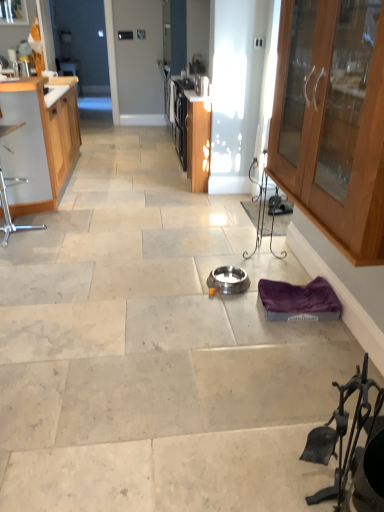
What do you see at coordinates (201, 85) in the screenshot? This screenshot has width=384, height=512. I see `metallic stainless steel toaster at upper center, which appears as the first appliance when viewed from the back` at bounding box center [201, 85].

Image resolution: width=384 pixels, height=512 pixels. What are the coordinates of `metallic silver chair at left, the second chair from the front` in the screenshot? It's located at (9, 210).

In order to face black wrought iron fireplace tools at lower right, which is counted as the second chair, starting from the top, should I rotate leftwards or rightwards?

Rotate right and turn 20.004 degrees.

Image resolution: width=384 pixels, height=512 pixels. What do you see at coordinates (40, 142) in the screenshot?
I see `wooden cabinet at left, the 2th cabinetry positioned from the front` at bounding box center [40, 142].

Locate an element on the screen. satin silver bowl at center, arranged as the second appliance when viewed from the back is located at coordinates (228, 280).

Is wooden cabinet at right, which is the first cabinetry from front to back, completely or partially inside satin silver bowl at center, which appears as the first appliance when viewed from the front?

Definitely not — wooden cabinet at right, which is the first cabinetry from front to back, is not inside satin silver bowl at center, which appears as the first appliance when viewed from the front.

In terms of height, does satin silver bowl at center, arranged as the second appliance when viewed from the back, look taller or shorter compared to wooden cabinet at right, which ranks as the 1th cabinetry in right-to-left order?

In the image, satin silver bowl at center, arranged as the second appliance when viewed from the back, appears to be shorter than wooden cabinet at right, which ranks as the 1th cabinetry in right-to-left order.

From a real-world perspective, which appliance is the 2nd one underneath the wooden cabinet at right, marked as the second cabinetry in a back-to-front arrangement? Please provide its 2D coordinates.

[(228, 280)]

Can you confirm if satin silver bowl at center, positioned as the first appliance in bottom-to-top order, is smaller than wooden cabinet at right, which is the first cabinetry from front to back?

Yes, satin silver bowl at center, positioned as the first appliance in bottom-to-top order, is smaller than wooden cabinet at right, which is the first cabinetry from front to back.

From a real-world perspective, is satin silver bowl at center, the 1th appliance from the right, positioned over metallic stainless steel toaster at upper center, positioned as the 1th appliance in left-to-right order, based on gravity?

No, from a real-world perspective, satin silver bowl at center, the 1th appliance from the right, is not on top of metallic stainless steel toaster at upper center, positioned as the 1th appliance in left-to-right order.

Consider the image. How much distance is there between satin silver bowl at center, the 1th appliance from the right, and metallic stainless steel toaster at upper center, which appears as the second appliance when viewed from the right?

satin silver bowl at center, the 1th appliance from the right, and metallic stainless steel toaster at upper center, which appears as the second appliance when viewed from the right, are 8.77 feet apart.

Visually, is satin silver bowl at center, which appears as the first appliance when viewed from the front, positioned to the left or to the right of metallic stainless steel toaster at upper center, positioned as the 1th appliance in left-to-right order?

In the image, satin silver bowl at center, which appears as the first appliance when viewed from the front, appears on the right side of metallic stainless steel toaster at upper center, positioned as the 1th appliance in left-to-right order.

Image resolution: width=384 pixels, height=512 pixels. What are the coordinates of `appliance that is behind the satin silver bowl at center, which appears as the first appliance when viewed from the front` in the screenshot? It's located at (201, 85).

Considering the relative sizes of satin silver bowl at center, which appears as the first appliance when viewed from the front, and black wrought iron fireplace tools at lower right, acting as the second chair starting from the back, in the image provided, is satin silver bowl at center, which appears as the first appliance when viewed from the front, wider than black wrought iron fireplace tools at lower right, acting as the second chair starting from the back,?

Yes, satin silver bowl at center, which appears as the first appliance when viewed from the front, is wider than black wrought iron fireplace tools at lower right, acting as the second chair starting from the back.

How much distance is there between satin silver bowl at center, the 1th appliance from the right, and black wrought iron fireplace tools at lower right, the second chair positioned from the left?

satin silver bowl at center, the 1th appliance from the right, is 1.25 meters away from black wrought iron fireplace tools at lower right, the second chair positioned from the left.

Is satin silver bowl at center, which appears as the first appliance when viewed from the front, completely or partially outside of black wrought iron fireplace tools at lower right, which is counted as the second chair, starting from the top?

satin silver bowl at center, which appears as the first appliance when viewed from the front, lies outside black wrought iron fireplace tools at lower right, which is counted as the second chair, starting from the top,'s area.

Is satin silver bowl at center, the 2th appliance in the top-to-bottom sequence, next to black wrought iron fireplace tools at lower right, which is counted as the second chair, starting from the top?

No, satin silver bowl at center, the 2th appliance in the top-to-bottom sequence, is not making contact with black wrought iron fireplace tools at lower right, which is counted as the second chair, starting from the top.

Which is further, (237, 269) or (1, 141)?

The point (1, 141) is farther.

Is satin silver bowl at center, the 1th appliance from the right, bigger than metallic silver chair at left, the second chair from the front?

No.

Considering the sizes of objects satin silver bowl at center, the 2th appliance in the top-to-bottom sequence, and metallic silver chair at left, the second chair from the front, in the image provided, who is wider, satin silver bowl at center, the 2th appliance in the top-to-bottom sequence, or metallic silver chair at left, the second chair from the front,?

metallic silver chair at left, the second chair from the front.

From the image's perspective, relative to metallic silver chair at left, the second chair from the front, is satin silver bowl at center, arranged as the second appliance when viewed from the back, above or below?

satin silver bowl at center, arranged as the second appliance when viewed from the back, is below metallic silver chair at left, the second chair from the front.

Is satin silver bowl at center, which appears as the first appliance when viewed from the front, at the left side of wooden cabinet at left, the 2th cabinetry positioned from the front?

Incorrect, satin silver bowl at center, which appears as the first appliance when viewed from the front, is not on the left side of wooden cabinet at left, the 2th cabinetry positioned from the front.

Between satin silver bowl at center, which appears as the first appliance when viewed from the front, and wooden cabinet at left, acting as the first cabinetry starting from the back, which one is positioned in front?

satin silver bowl at center, which appears as the first appliance when viewed from the front, is in front.

Where is `appliance below the wooden cabinet at left, acting as the first cabinetry starting from the back (from a real-world perspective)`? appliance below the wooden cabinet at left, acting as the first cabinetry starting from the back (from a real-world perspective) is located at coordinates (228, 280).

From the image's perspective, is satin silver bowl at center, the 1th appliance from the right, above wooden cabinet at left, acting as the first cabinetry starting from the back?

No, from the image's perspective, satin silver bowl at center, the 1th appliance from the right, is not on top of wooden cabinet at left, acting as the first cabinetry starting from the back.

Considering the relative sizes of black wrought iron fireplace tools at lower right, acting as the second chair starting from the back, and satin silver bowl at center, positioned as the first appliance in bottom-to-top order, in the image provided, is black wrought iron fireplace tools at lower right, acting as the second chair starting from the back, taller than satin silver bowl at center, positioned as the first appliance in bottom-to-top order,?

Yes, black wrought iron fireplace tools at lower right, acting as the second chair starting from the back, is taller than satin silver bowl at center, positioned as the first appliance in bottom-to-top order.

Where is `the 1st appliance behind when counting from the black wrought iron fireplace tools at lower right, acting as the second chair starting from the back`? This screenshot has width=384, height=512. the 1st appliance behind when counting from the black wrought iron fireplace tools at lower right, acting as the second chair starting from the back is located at coordinates (228, 280).

Which object is closer to the camera, black wrought iron fireplace tools at lower right, acting as the second chair starting from the back, or satin silver bowl at center, positioned as the first appliance in bottom-to-top order?

black wrought iron fireplace tools at lower right, acting as the second chair starting from the back, is closer to the camera.

Can you confirm if black wrought iron fireplace tools at lower right, which is the first chair from front to back, is positioned to the right of satin silver bowl at center, the 1th appliance from the right?

Indeed, black wrought iron fireplace tools at lower right, which is the first chair from front to back, is positioned on the right side of satin silver bowl at center, the 1th appliance from the right.

Could you tell me if metallic silver chair at left, the 2th chair when ordered from bottom to top, is turned towards satin silver bowl at center, which appears as the first appliance when viewed from the front?

No, metallic silver chair at left, the 2th chair when ordered from bottom to top, is not facing towards satin silver bowl at center, which appears as the first appliance when viewed from the front.

Is metallic silver chair at left, the 2th chair when ordered from bottom to top, inside the boundaries of satin silver bowl at center, arranged as the second appliance when viewed from the back, or outside?

metallic silver chair at left, the 2th chair when ordered from bottom to top, cannot be found inside satin silver bowl at center, arranged as the second appliance when viewed from the back.

Is point (30, 226) more distant than point (213, 273)?

Yes, point (30, 226) is behind point (213, 273).

At what (x,y) coordinates should I click in order to perform the action: click on the 1st cabinetry positioned above the satin silver bowl at center, arranged as the second appliance when viewed from the back (from the image's perspective). Please return your answer as a coordinate pair (x, y). Looking at the image, I should click on (332, 120).

The image size is (384, 512). I want to click on appliance on the left side of satin silver bowl at center, the 1th appliance from the right, so click(x=201, y=85).

Considering their positions, is satin silver bowl at center, the second appliance viewed from the left, positioned closer to metallic silver chair at left, positioned as the 2th chair in right-to-left order, than wooden cabinet at left, the 2th cabinetry positioned from the front?

Based on the image, wooden cabinet at left, the 2th cabinetry positioned from the front, appears to be nearer to metallic silver chair at left, positioned as the 2th chair in right-to-left order.

Considering their positions, is black wrought iron fireplace tools at lower right, the second chair positioned from the left, positioned closer to metallic silver chair at left, positioned as the 2th chair in right-to-left order, than satin silver bowl at center, which appears as the first appliance when viewed from the front?

satin silver bowl at center, which appears as the first appliance when viewed from the front, is closer to metallic silver chair at left, positioned as the 2th chair in right-to-left order.

Looking at the image, which one is located further to metallic silver chair at left, which is counted as the 1th chair, starting from the top, wooden cabinet at right, marked as the second cabinetry in a back-to-front arrangement, or wooden cabinet at left, arranged as the first cabinetry when viewed from the left?

Among the two, wooden cabinet at right, marked as the second cabinetry in a back-to-front arrangement, is located further to metallic silver chair at left, which is counted as the 1th chair, starting from the top.

Looking at this image, considering their positions, is wooden cabinet at left, arranged as the first cabinetry when viewed from the left, positioned further to black wrought iron fireplace tools at lower right, the first chair in the right-to-left sequence, than metallic stainless steel toaster at upper center, which is the first appliance in top-to-bottom order?

Among the two, metallic stainless steel toaster at upper center, which is the first appliance in top-to-bottom order, is located further to black wrought iron fireplace tools at lower right, the first chair in the right-to-left sequence.

Which object lies nearer to the anchor point wooden cabinet at left, the second cabinetry from the right, metallic stainless steel toaster at upper center, which appears as the first appliance when viewed from the back, or wooden cabinet at right, arranged as the 2th cabinetry when viewed from the left?

metallic stainless steel toaster at upper center, which appears as the first appliance when viewed from the back, is closer to wooden cabinet at left, the second cabinetry from the right.

Looking at the image, which one is located further to metallic stainless steel toaster at upper center, which appears as the first appliance when viewed from the back, black wrought iron fireplace tools at lower right, which is the first chair from front to back, or satin silver bowl at center, the 1th appliance from the right?

The object further to metallic stainless steel toaster at upper center, which appears as the first appliance when viewed from the back, is black wrought iron fireplace tools at lower right, which is the first chair from front to back.

In the scene shown: Looking at the image, which one is located further to satin silver bowl at center, the second appliance viewed from the left, wooden cabinet at left, acting as the first cabinetry starting from the back, or metallic stainless steel toaster at upper center, which appears as the second appliance when viewed from the right?

metallic stainless steel toaster at upper center, which appears as the second appliance when viewed from the right, lies further to satin silver bowl at center, the second appliance viewed from the left, than the other object.

Based on their spatial positions, is wooden cabinet at right, which ranks as the 1th cabinetry in right-to-left order, or metallic silver chair at left, the second chair from the front, closer to black wrought iron fireplace tools at lower right, which is counted as the second chair, starting from the top?

wooden cabinet at right, which ranks as the 1th cabinetry in right-to-left order, is closer to black wrought iron fireplace tools at lower right, which is counted as the second chair, starting from the top.

At what (x,y) coordinates should I click in order to perform the action: click on appliance between wooden cabinet at right, which is the first cabinetry from front to back, and metallic stainless steel toaster at upper center, which is the first appliance in top-to-bottom order, in the front-back direction. Please return your answer as a coordinate pair (x, y). Looking at the image, I should click on tap(228, 280).

Locate an element on the screen. appliance located between black wrought iron fireplace tools at lower right, which is the 1th chair from bottom to top, and metallic stainless steel toaster at upper center, which appears as the second appliance when viewed from the right, in the depth direction is located at coordinates (228, 280).

What are the coordinates of `chair located between wooden cabinet at left, acting as the first cabinetry starting from the back, and satin silver bowl at center, the 2th appliance in the top-to-bottom sequence, in the left-right direction` in the screenshot? It's located at (9, 210).

Identify the location of chair located between wooden cabinet at right, marked as the second cabinetry in a back-to-front arrangement, and satin silver bowl at center, arranged as the second appliance when viewed from the back, in the depth direction. This screenshot has height=512, width=384. (340, 434).